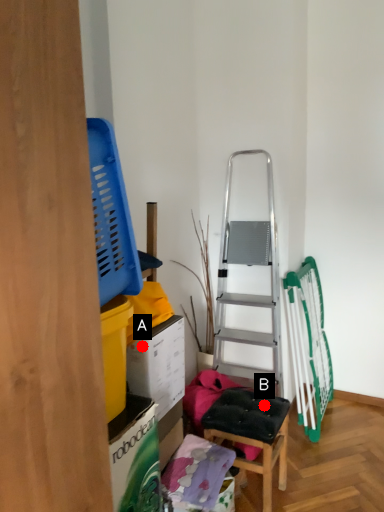
Question: Two points are circled on the image, labeled by A and B beside each circle. Which point appears closest to the camera in this image?

Choices:
 (A) A is closer
 (B) B is closer

Answer: (A)